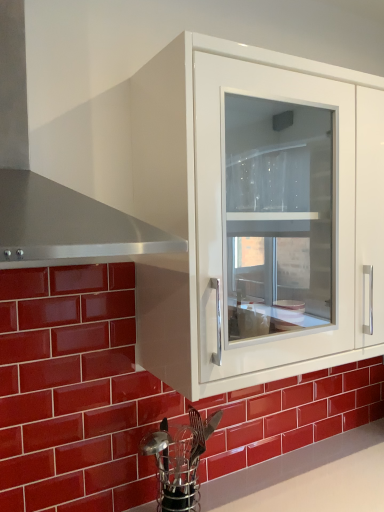
Where is `metallic silver utensil holder at lower center`? Image resolution: width=384 pixels, height=512 pixels. metallic silver utensil holder at lower center is located at coordinates (179, 460).

Is white glossy cabinet at upper center taller than metallic silver utensil holder at lower center?

Indeed, white glossy cabinet at upper center has a greater height compared to metallic silver utensil holder at lower center.

From a real-world perspective, is white glossy cabinet at upper center under metallic silver utensil holder at lower center?

Actually, white glossy cabinet at upper center is physically above metallic silver utensil holder at lower center in the real world.

From the image's perspective, does white glossy cabinet at upper center appear higher than metallic silver utensil holder at lower center?

Correct, white glossy cabinet at upper center appears higher than metallic silver utensil holder at lower center in the image.

From the picture: Is white glossy cabinet at upper center wider than metallic silver utensil holder at lower center?

Yes.

From the image's perspective, is glossy ceramic brick at lower left above or below metallic silver utensil holder at lower center?

glossy ceramic brick at lower left is situated higher than metallic silver utensil holder at lower center in the image.

Consider the image. Which object is closer to the camera taking this photo, glossy ceramic brick at lower left or metallic silver utensil holder at lower center?

glossy ceramic brick at lower left.

Is glossy ceramic brick at lower left shorter than metallic silver utensil holder at lower center?

Incorrect, the height of glossy ceramic brick at lower left does not fall short of that of metallic silver utensil holder at lower center.

Is glossy ceramic brick at lower left facing towards metallic silver utensil holder at lower center?

Yes, glossy ceramic brick at lower left is oriented towards metallic silver utensil holder at lower center.

Does stainless steel exhaust hood at left lie in front of glossy ceramic brick at lower left?

Yes, it is in front of glossy ceramic brick at lower left.

Would you say glossy ceramic brick at lower left is part of stainless steel exhaust hood at left's contents?

No, glossy ceramic brick at lower left is not inside stainless steel exhaust hood at left.

Considering the relative sizes of stainless steel exhaust hood at left and glossy ceramic brick at lower left in the image provided, is stainless steel exhaust hood at left thinner than glossy ceramic brick at lower left?

No, stainless steel exhaust hood at left is not thinner than glossy ceramic brick at lower left.

Based on their sizes in the image, would you say stainless steel exhaust hood at left is bigger or smaller than glossy ceramic brick at lower left?

In the image, stainless steel exhaust hood at left appears to be larger than glossy ceramic brick at lower left.

Considering the sizes of objects glossy ceramic brick at lower left and white glossy cabinet at upper center in the image provided, who is bigger, glossy ceramic brick at lower left or white glossy cabinet at upper center?

white glossy cabinet at upper center is bigger.

This screenshot has height=512, width=384. I want to click on cabinetry above the glossy ceramic brick at lower left (from the image's perspective), so click(250, 217).

Considering the relative positions of glossy ceramic brick at lower left and white glossy cabinet at upper center in the image provided, is glossy ceramic brick at lower left in front of white glossy cabinet at upper center?

That is False.

Does glossy ceramic brick at lower left contain white glossy cabinet at upper center?

No, glossy ceramic brick at lower left does not contain white glossy cabinet at upper center.

Between white glossy cabinet at upper center and glossy ceramic brick at lower left, which one has larger width?

→ Wider between the two is white glossy cabinet at upper center.

Which of these two, white glossy cabinet at upper center or glossy ceramic brick at lower left, is smaller?

With smaller size is glossy ceramic brick at lower left.

Does white glossy cabinet at upper center turn towards glossy ceramic brick at lower left?

No, white glossy cabinet at upper center is not oriented towards glossy ceramic brick at lower left.

Which of these two, white glossy cabinet at upper center or glossy ceramic brick at lower left, stands shorter?

white glossy cabinet at upper center is shorter.

Is metallic silver utensil holder at lower center at the right side of white glossy cabinet at upper center?

Incorrect, metallic silver utensil holder at lower center is not on the right side of white glossy cabinet at upper center.

Is white glossy cabinet at upper center completely or partially inside metallic silver utensil holder at lower center?

Definitely not — white glossy cabinet at upper center is not inside metallic silver utensil holder at lower center.

Considering the relative sizes of metallic silver utensil holder at lower center and white glossy cabinet at upper center in the image provided, is metallic silver utensil holder at lower center thinner than white glossy cabinet at upper center?

Indeed, metallic silver utensil holder at lower center has a lesser width compared to white glossy cabinet at upper center.

Is metallic silver utensil holder at lower center positioned in front of white glossy cabinet at upper center?

No, metallic silver utensil holder at lower center is behind white glossy cabinet at upper center.

Considering the positions of point (146, 398) and point (141, 231), is point (146, 398) closer or farther from the camera than point (141, 231)?

Point (146, 398).

From the image's perspective, which object appears higher, glossy ceramic brick at lower left or stainless steel exhaust hood at left?

From the image's view, stainless steel exhaust hood at left is above.

Who is taller, glossy ceramic brick at lower left or stainless steel exhaust hood at left?

Standing taller between the two is glossy ceramic brick at lower left.

Is glossy ceramic brick at lower left facing towards stainless steel exhaust hood at left?

No, glossy ceramic brick at lower left does not turn towards stainless steel exhaust hood at left.

Where is `appliance below the white glossy cabinet at upper center (from a real-world perspective)`? appliance below the white glossy cabinet at upper center (from a real-world perspective) is located at coordinates (179, 460).

The image size is (384, 512). Identify the location of brick that appears above the metallic silver utensil holder at lower center (from the image's perspective). (75, 392).

From the image, which object appears to be farther from metallic silver utensil holder at lower center, stainless steel exhaust hood at left or glossy ceramic brick at lower left?

stainless steel exhaust hood at left is further to metallic silver utensil holder at lower center.

When comparing their distances from stainless steel exhaust hood at left, does glossy ceramic brick at lower left or metallic silver utensil holder at lower center seem closer?

Among the two, glossy ceramic brick at lower left is located nearer to stainless steel exhaust hood at left.

From the image, which object appears to be nearer to white glossy cabinet at upper center, stainless steel exhaust hood at left or glossy ceramic brick at lower left?

Among the two, glossy ceramic brick at lower left is located nearer to white glossy cabinet at upper center.

From the image, which object appears to be nearer to stainless steel exhaust hood at left, glossy ceramic brick at lower left or white glossy cabinet at upper center?

The object closer to stainless steel exhaust hood at left is white glossy cabinet at upper center.

Considering their positions, is metallic silver utensil holder at lower center positioned further to glossy ceramic brick at lower left than stainless steel exhaust hood at left?

stainless steel exhaust hood at left.

Considering their positions, is stainless steel exhaust hood at left positioned further to white glossy cabinet at upper center than metallic silver utensil holder at lower center?

metallic silver utensil holder at lower center lies further to white glossy cabinet at upper center than the other object.

Which object lies nearer to the anchor point white glossy cabinet at upper center, metallic silver utensil holder at lower center or glossy ceramic brick at lower left?

glossy ceramic brick at lower left is closer to white glossy cabinet at upper center.

From the image, which object appears to be farther from metallic silver utensil holder at lower center, glossy ceramic brick at lower left or stainless steel exhaust hood at left?

stainless steel exhaust hood at left is positioned further to the anchor metallic silver utensil holder at lower center.

The height and width of the screenshot is (512, 384). I want to click on cabinetry between stainless steel exhaust hood at left and metallic silver utensil holder at lower center from top to bottom, so click(250, 217).

The image size is (384, 512). What are the coordinates of `cabinetry between stainless steel exhaust hood at left and glossy ceramic brick at lower left vertically` in the screenshot? It's located at (250, 217).

The width and height of the screenshot is (384, 512). Find the location of `brick between stainless steel exhaust hood at left and metallic silver utensil holder at lower center from top to bottom`. brick between stainless steel exhaust hood at left and metallic silver utensil holder at lower center from top to bottom is located at coordinates point(75,392).

I want to click on brick between white glossy cabinet at upper center and metallic silver utensil holder at lower center in the up-down direction, so [75, 392].